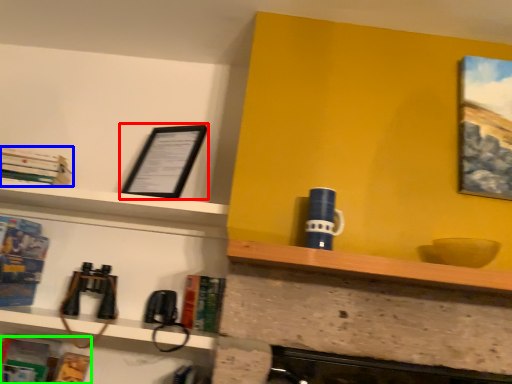
Question: Considering the real-world distances, which object is closest to picture frame (highlighted by a red box)? book (highlighted by a blue box) or book (highlighted by a green box).

Choices:
 (A) book
 (B) book

Answer: (A)